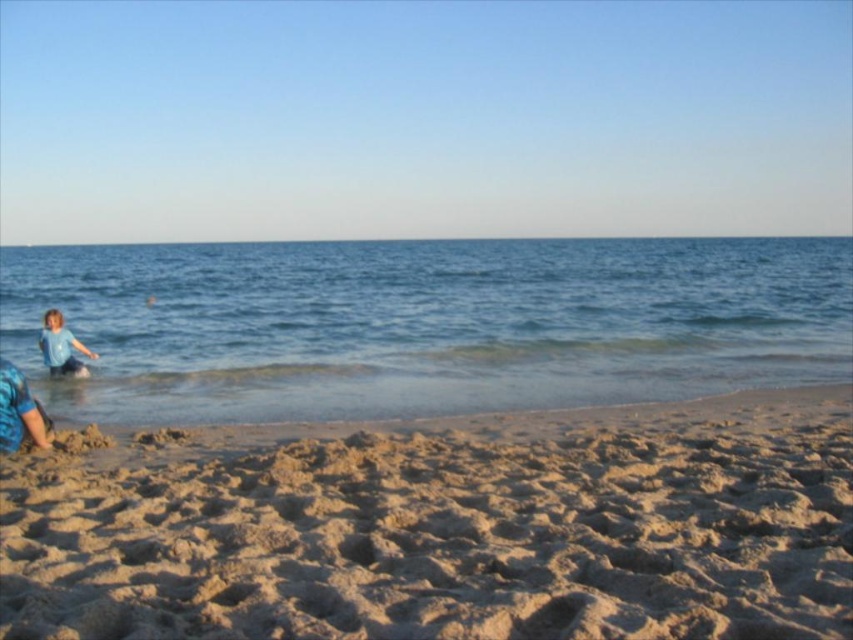
You are standing on the beach and want to pour the blue liquid water at left into a container that can hold up to 10 meters of liquid. Will the container overflow?

The blue liquid water at left is 11.12 meters from viewer, so pouring it into a container that can hold up to 10 meters will cause overflow.

You are standing on the beach and want to know if the blue liquid water at left can cover the light blue fabric shirt at left if the tide rises. Based on their current positions, what do you think?

The blue liquid water at left might be wider than the light blue fabric shirt at left, so if the tide rises, the water could potentially cover the shirt depending on the water level increase.